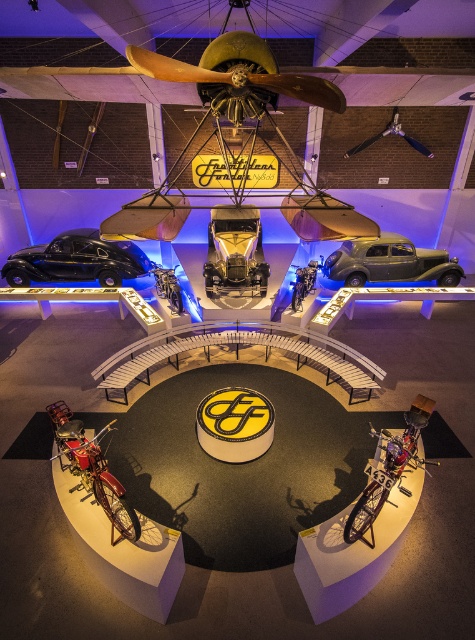
Question: Is gold metallic car at center to the right of metallic silver propeller at center from the viewer's perspective?

Choices:
 (A) yes
 (B) no

Answer: (B)

Question: Among these objects, which one is farthest from the camera?

Choices:
 (A) gold metallic car at center
 (B) matte silver car at center

Answer: (B)

Question: Does matte silver car at center appear on the right side of metallic silver propeller at center?

Choices:
 (A) yes
 (B) no

Answer: (A)

Question: Is shiny black car at left to the right of metallic silver propeller at center from the viewer's perspective?

Choices:
 (A) yes
 (B) no

Answer: (B)

Question: Which point is closer to the camera?

Choices:
 (A) (361, 147)
 (B) (87, 230)
 (C) (267, 266)

Answer: (C)

Question: Estimate the real-world distances between objects in this image. Which object is farther from the matte silver car at center?

Choices:
 (A) shiny black car at left
 (B) metallic silver propeller at center

Answer: (A)